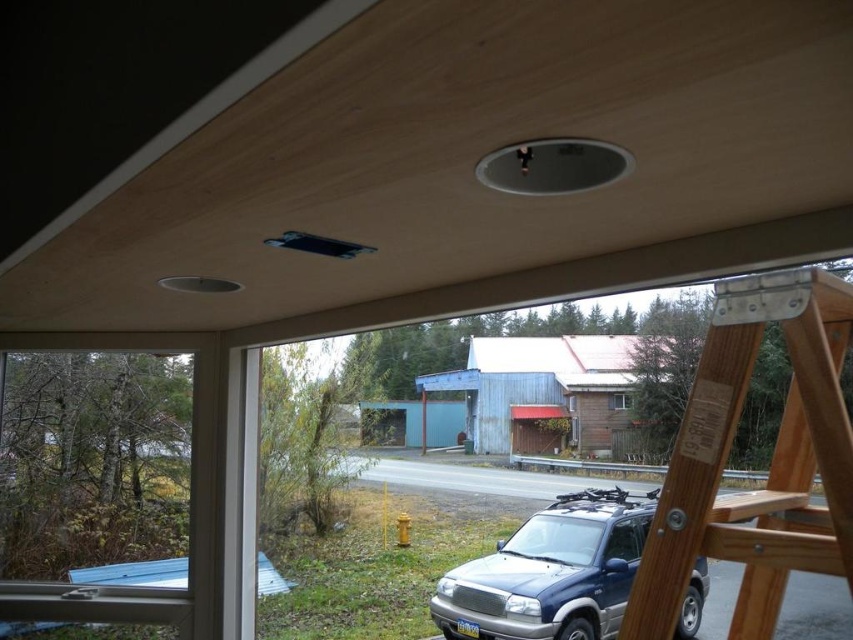
You are standing inside the cabin looking out the window. There is a point marked at coordinates [769,465]. Which object is this point located on?

The point at coordinates [769,465] is located on the wooden ladder at right.

You are standing inside the cabin and want to look outside through the brown wooden window at center. Is the wooden ladder at right blocking your view of the window?

The wooden ladder at right is in front of the brown wooden window at center, so it is blocking your view of the window.

You are standing inside the cabin and want to look out through the clear glass window at left. Where should you position yourself to see the window?

The clear glass window at left is located at point (x=96, y=467), so you should position yourself near that coordinate to see the window.